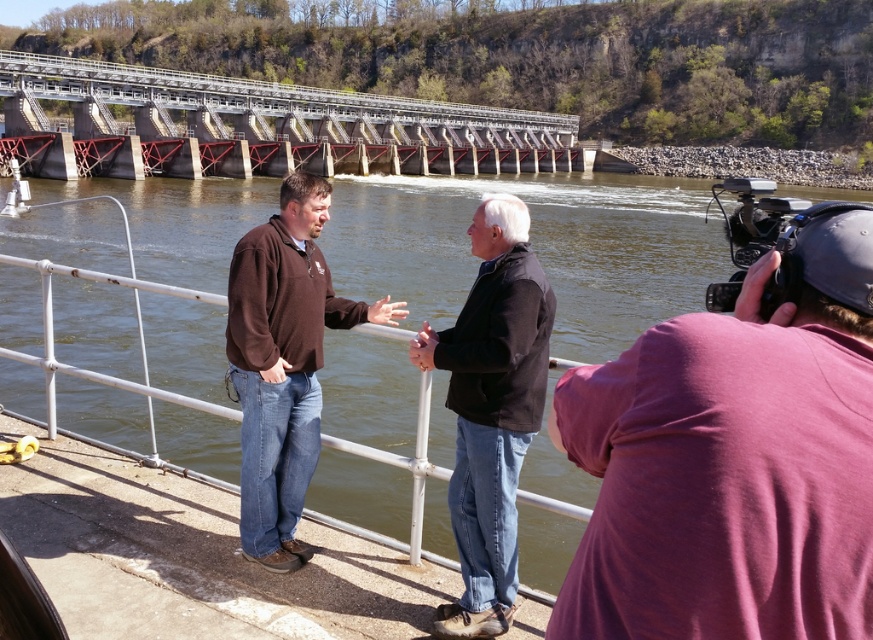
Question: Does red metal bridge at upper center appear on the right side of brown fleece at center?

Choices:
 (A) no
 (B) yes

Answer: (A)

Question: Which point is closer to the camera?

Choices:
 (A) (574, 134)
 (B) (605, 444)
 (C) (468, 376)
 (D) (435, 314)

Answer: (B)

Question: Which of the following is the farthest from the observer?

Choices:
 (A) black matte jacket at center
 (B) red metal bridge at upper center
 (C) brown fleece at center
 (D) greenish-brown water at center

Answer: (B)

Question: Can you confirm if greenish-brown water at center is positioned to the left of red metal bridge at upper center?

Choices:
 (A) yes
 (B) no

Answer: (B)

Question: Is black matte jacket at center closer to camera compared to brown fleece at center?

Choices:
 (A) yes
 (B) no

Answer: (A)

Question: Which of the following is the closest to the observer?

Choices:
 (A) purple cotton shirt at right
 (B) black matte jacket at center
 (C) brown fleece at center

Answer: (A)